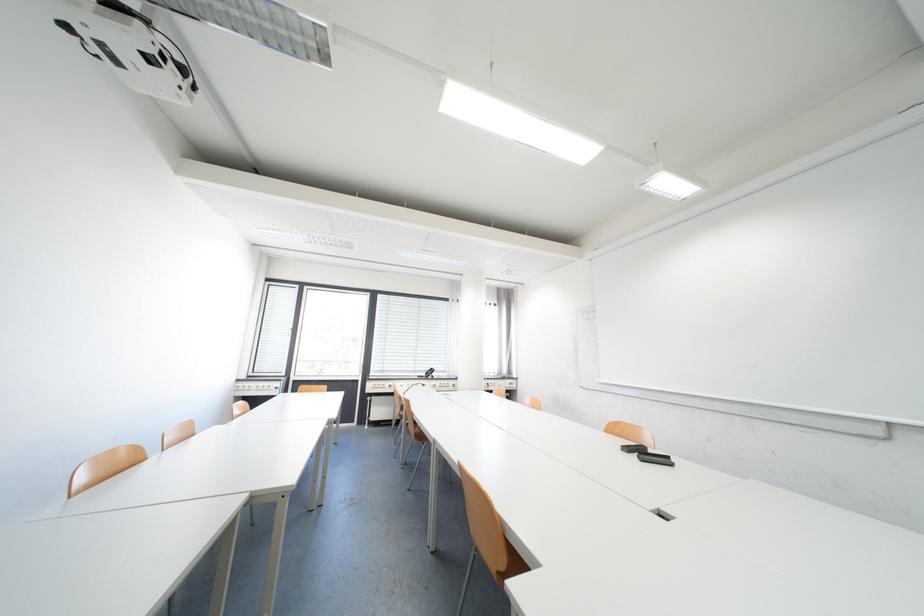
You are a GUI agent. You are given a task and a screenshot of the screen. Output one action in this format:
    pyautogui.click(x=<x>, y=<y>)
    Task: Click on the black board eraser
    
    Given the screenshot: What is the action you would take?
    pyautogui.click(x=654, y=458)